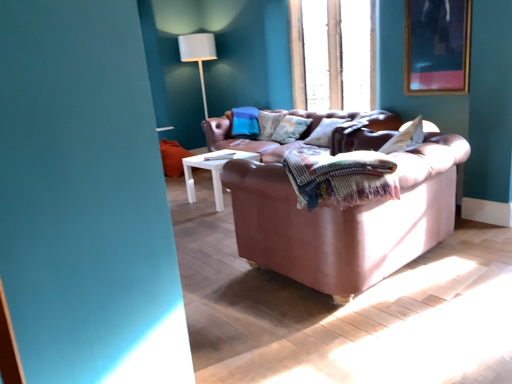
Question: Should I look upward or downward to see leather couch at center?

Choices:
 (A) down
 (B) up

Answer: (A)

Question: Can you confirm if wooden-framed artwork at upper right is bigger than textured beige pillow at center?

Choices:
 (A) no
 (B) yes

Answer: (A)

Question: Can you confirm if wooden-framed artwork at upper right is taller than textured beige pillow at center?

Choices:
 (A) no
 (B) yes

Answer: (B)

Question: Is wooden-framed artwork at upper right behind textured beige pillow at center?

Choices:
 (A) yes
 (B) no

Answer: (B)

Question: Is textured beige pillow at center located within wooden-framed artwork at upper right?

Choices:
 (A) no
 (B) yes

Answer: (A)

Question: Is wooden-framed artwork at upper right thinner than textured beige pillow at center?

Choices:
 (A) no
 (B) yes

Answer: (B)

Question: From a real-world perspective, is wooden-framed artwork at upper right positioned under textured beige pillow at center based on gravity?

Choices:
 (A) yes
 (B) no

Answer: (B)

Question: Is wooden at upper center smaller than white fabric lampshade at upper center?

Choices:
 (A) yes
 (B) no

Answer: (A)

Question: Does wooden at upper center appear on the left side of white fabric lampshade at upper center?

Choices:
 (A) yes
 (B) no

Answer: (B)

Question: Is wooden at upper center positioned behind white fabric lampshade at upper center?

Choices:
 (A) yes
 (B) no

Answer: (B)

Question: Is the position of wooden at upper center less distant than that of white fabric lampshade at upper center?

Choices:
 (A) yes
 (B) no

Answer: (A)

Question: Considering the relative sizes of wooden at upper center and white fabric lampshade at upper center in the image provided, is wooden at upper center thinner than white fabric lampshade at upper center?

Choices:
 (A) no
 (B) yes

Answer: (B)

Question: Is wooden at upper center surrounding white fabric lampshade at upper center?

Choices:
 (A) yes
 (B) no

Answer: (B)

Question: Is wooden at upper center outside wooden-framed artwork at upper right?

Choices:
 (A) yes
 (B) no

Answer: (A)